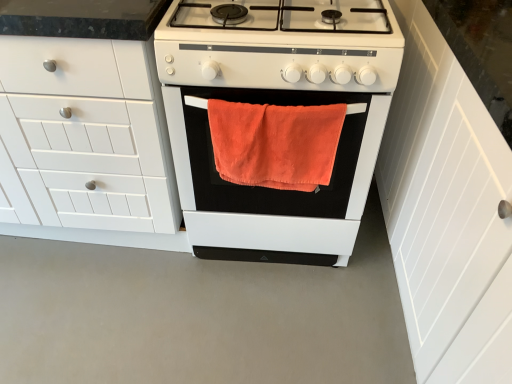
Question: From a real-world perspective, is white wood cabinet at right, marked as the 2th cabinetry in a left-to-right arrangement, positioned above or below white matte gas stove at center?

Choices:
 (A) below
 (B) above

Answer: (A)

Question: Which is correct: white wood cabinet at right, which is counted as the first cabinetry, starting from the right, is inside white matte gas stove at center, or outside of it?

Choices:
 (A) inside
 (B) outside

Answer: (B)

Question: Which of these objects is positioned farthest from the orange cotton towel at center?

Choices:
 (A) white matte cabinet at left, arranged as the first cabinetry when viewed from the left
 (B) white matte gas stove at center
 (C) white wood cabinet at right, marked as the 2th cabinetry in a left-to-right arrangement
 (D) white matte oven at center

Answer: (C)

Question: Estimate the real-world distances between objects in this image. Which object is farther from the white matte oven at center?

Choices:
 (A) orange cotton towel at center
 (B) white wood cabinet at right, marked as the 2th cabinetry in a left-to-right arrangement
 (C) white matte cabinet at left, acting as the 2th cabinetry starting from the right
 (D) white matte gas stove at center

Answer: (B)